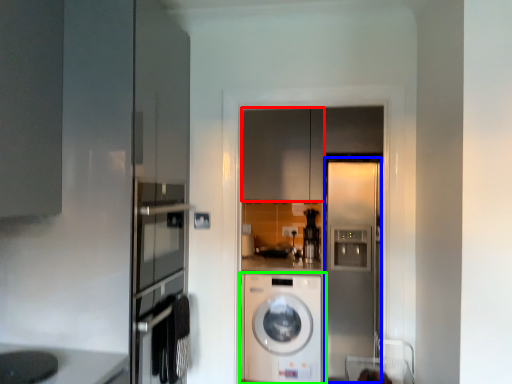
Question: Which is nearer to the cabinetry (highlighted by a red box)? screen door (highlighted by a blue box) or washing machine (highlighted by a green box).

Choices:
 (A) screen door
 (B) washing machine

Answer: (A)